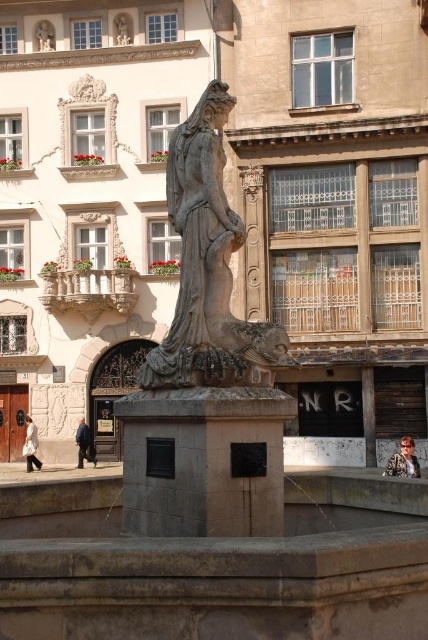
Can you confirm if shiny brown hair at center is positioned below dark blue jeans at lower left?

No.

Can you confirm if shiny brown hair at center is positioned above dark blue jeans at lower left?

Correct, shiny brown hair at center is located above dark blue jeans at lower left.

Where is `shiny brown hair at center`? shiny brown hair at center is located at coordinates (403, 460).

Does white fabric coat at lower left appear under dark blue jeans at lower left?

Yes, white fabric coat at lower left is below dark blue jeans at lower left.

Can you confirm if white fabric coat at lower left is positioned above dark blue jeans at lower left?

Incorrect, white fabric coat at lower left is not positioned above dark blue jeans at lower left.

Identify the location of white fabric coat at lower left. (30, 445).

Does bronze statue at center have a greater width compared to shiny brown hair at center?

Yes, bronze statue at center is wider than shiny brown hair at center.

Is bronze statue at center taller than shiny brown hair at center?

Indeed, bronze statue at center has a greater height compared to shiny brown hair at center.

Who is more forward, [270,384] or [397,452]?

Point [270,384] is more forward.

Locate an element on the screen. This screenshot has height=640, width=428. bronze statue at center is located at coordinates (208, 268).